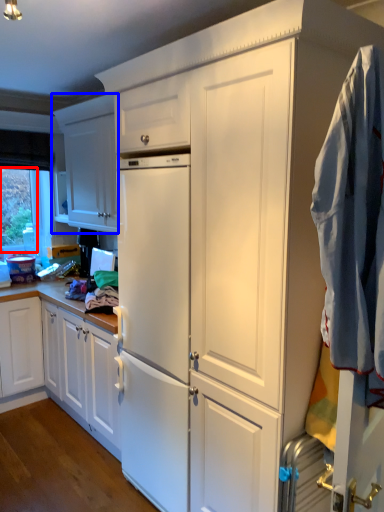
Question: Which point is closer to the camera, window screen (highlighted by a red box) or cabinetry (highlighted by a blue box)?

Choices:
 (A) window screen
 (B) cabinetry

Answer: (B)